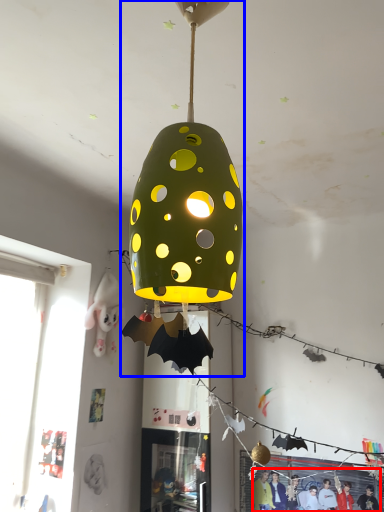
Question: Which point is further to the camera, person (highlighted by a red box) or lamp (highlighted by a blue box)?

Choices:
 (A) person
 (B) lamp

Answer: (A)